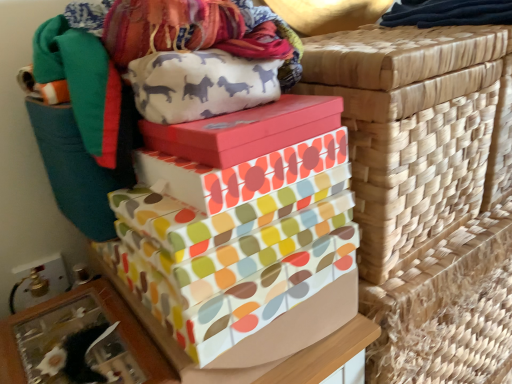
Question: Is multicolored fabric gift box at center, the 2th gift box viewed from the top, inside or outside of woven straw basket at upper right?

Choices:
 (A) outside
 (B) inside

Answer: (A)

Question: Considering the positions of point (252, 188) and point (454, 168), is point (252, 188) closer or farther from the camera than point (454, 168)?

Choices:
 (A) closer
 (B) farther

Answer: (A)

Question: Considering the real-world distances, which object is closest to the multicolored fabric gift box at center, the second gift box from the bottom?

Choices:
 (A) woven straw basket at upper right
 (B) multicolored paper gift boxes at center, acting as the third gift box starting from the top
 (C) matte pink box at center, placed as the third gift box when sorted from bottom to top
 (D) multicolored woven fabric at upper left

Answer: (C)

Question: Estimate the real-world distances between objects in this image. Which object is closer to the multicolored woven fabric at upper left?

Choices:
 (A) multicolored paper gift boxes at center, acting as the third gift box starting from the top
 (B) matte pink box at center, placed as the third gift box when sorted from bottom to top
 (C) multicolored fabric gift box at center, the 2th gift box viewed from the top
 (D) woven straw basket at upper right

Answer: (B)